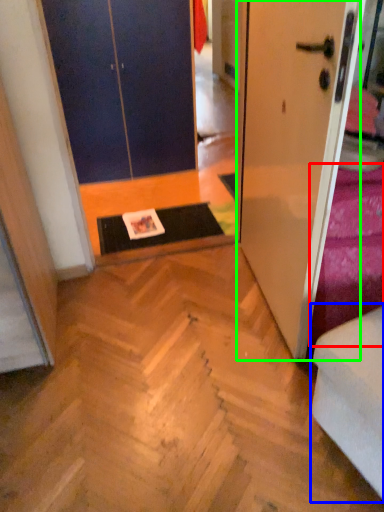
Question: Which is nearer to the bedding (highlighted by a red box)? armchair (highlighted by a blue box) or door (highlighted by a green box).

Choices:
 (A) armchair
 (B) door

Answer: (B)